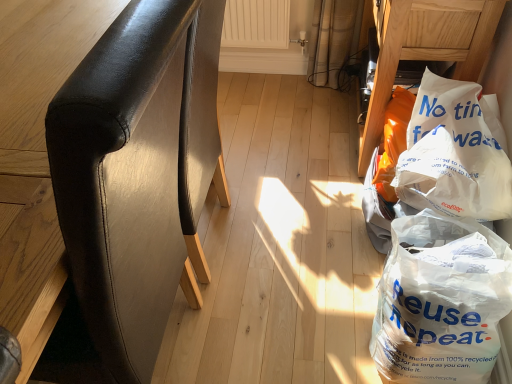
Locate an element on the screen. The height and width of the screenshot is (384, 512). white plastic bag at lower right, which is the second plastic bag from top to bottom is located at coordinates (441, 301).

Image resolution: width=512 pixels, height=384 pixels. What do you see at coordinates (455, 152) in the screenshot? I see `white paper bag at lower right, the second plastic bag when ordered from bottom to top` at bounding box center [455, 152].

This screenshot has width=512, height=384. Describe the element at coordinates (428, 49) in the screenshot. I see `white plastic bag at lower right, the second furniture when ordered from left to right` at that location.

You are a GUI agent. You are given a task and a screenshot of the screen. Output one action in this format:
    pyautogui.click(x=<x>, y=<y>)
    Task: Click on the white plastic bag at lower right, which is the second plastic bag from top to bottom
    This screenshot has width=512, height=384.
    Given the screenshot: What is the action you would take?
    pyautogui.click(x=441, y=301)

How different are the orientations of white paper bag at lower right, which is the 1th plastic bag in top-to-bottom order, and white plastic bag at lower right, which is the 1th furniture in right-to-left order, in degrees?

white paper bag at lower right, which is the 1th plastic bag in top-to-bottom order, and white plastic bag at lower right, which is the 1th furniture in right-to-left order, are facing 0.155 degrees away from each other.

The height and width of the screenshot is (384, 512). I want to click on furniture above the white paper bag at lower right, the second plastic bag when ordered from bottom to top (from the image's perspective), so click(x=428, y=49).

Does white paper bag at lower right, which is the 1th plastic bag in top-to-bottom order, appear on the left side of white plastic bag at lower right, which is the 1th furniture in right-to-left order?

Indeed, white paper bag at lower right, which is the 1th plastic bag in top-to-bottom order, is positioned on the left side of white plastic bag at lower right, which is the 1th furniture in right-to-left order.

Is white plastic bag at lower right, the second furniture when ordered from left to right, completely or partially inside white paper bag at lower right, the second plastic bag when ordered from bottom to top?

Definitely not — white plastic bag at lower right, the second furniture when ordered from left to right, is not inside white paper bag at lower right, the second plastic bag when ordered from bottom to top.

Between white paper bag at lower right, the second plastic bag when ordered from bottom to top, and black leather chair at left, the first furniture from the left, which one has smaller width?

Thinner between the two is white paper bag at lower right, the second plastic bag when ordered from bottom to top.

Is white paper bag at lower right, which is the 1th plastic bag in top-to-bottom order, facing towards black leather chair at left, which ranks as the second furniture in right-to-left order?

Yes, white paper bag at lower right, which is the 1th plastic bag in top-to-bottom order, faces towards black leather chair at left, which ranks as the second furniture in right-to-left order.

From the image's perspective, which one is positioned higher, white paper bag at lower right, which is the 1th plastic bag in top-to-bottom order, or black leather chair at left, the first furniture from the left?

white paper bag at lower right, which is the 1th plastic bag in top-to-bottom order, from the image's perspective.

Based on the photo, considering the positions of objects white paper bag at lower right, the second plastic bag when ordered from bottom to top, and white plastic bag at lower right, positioned as the 1th plastic bag in bottom-to-top order, in the image provided, who is more to the left, white paper bag at lower right, the second plastic bag when ordered from bottom to top, or white plastic bag at lower right, positioned as the 1th plastic bag in bottom-to-top order,?

Positioned to the left is white plastic bag at lower right, positioned as the 1th plastic bag in bottom-to-top order.

Could you tell me if white paper bag at lower right, the second plastic bag when ordered from bottom to top, is turned towards white plastic bag at lower right, positioned as the 1th plastic bag in bottom-to-top order?

No, white paper bag at lower right, the second plastic bag when ordered from bottom to top, is not turned towards white plastic bag at lower right, positioned as the 1th plastic bag in bottom-to-top order.

Is white paper bag at lower right, which is the 1th plastic bag in top-to-bottom order, far from white plastic bag at lower right, which is the second plastic bag from top to bottom?

No, there isn't a large distance between white paper bag at lower right, which is the 1th plastic bag in top-to-bottom order, and white plastic bag at lower right, which is the second plastic bag from top to bottom.

Which object is positioned more to the right, white plastic bag at lower right, the second furniture when ordered from left to right, or white plastic bag at lower right, positioned as the 1th plastic bag in bottom-to-top order?

white plastic bag at lower right, the second furniture when ordered from left to right.

At what (x,y) coordinates should I click in order to perform the action: click on plastic bag that is the 2nd object to the left of the white plastic bag at lower right, which is the 1th furniture in right-to-left order, starting at the anchor. Please return your answer as a coordinate pair (x, y). This screenshot has height=384, width=512. Looking at the image, I should click on (441, 301).

How different are the orientations of white plastic bag at lower right, the second furniture when ordered from left to right, and white plastic bag at lower right, positioned as the 1th plastic bag in bottom-to-top order, in degrees?

There is a 0.155-degree angle between the facing directions of white plastic bag at lower right, the second furniture when ordered from left to right, and white plastic bag at lower right, positioned as the 1th plastic bag in bottom-to-top order.

Is white plastic bag at lower right, the second furniture when ordered from left to right, shorter than white plastic bag at lower right, positioned as the 1th plastic bag in bottom-to-top order?

In fact, white plastic bag at lower right, the second furniture when ordered from left to right, may be taller than white plastic bag at lower right, positioned as the 1th plastic bag in bottom-to-top order.

How far apart are black leather chair at left, the first furniture from the left, and white plastic bag at lower right, positioned as the 1th plastic bag in bottom-to-top order?

black leather chair at left, the first furniture from the left, and white plastic bag at lower right, positioned as the 1th plastic bag in bottom-to-top order, are 27.25 inches apart.

Image resolution: width=512 pixels, height=384 pixels. I want to click on plastic bag below the black leather chair at left, the first furniture from the left (from the image's perspective), so click(441, 301).

Is black leather chair at left, which ranks as the second furniture in right-to-left order, smaller than white plastic bag at lower right, which is the second plastic bag from top to bottom?

Incorrect, black leather chair at left, which ranks as the second furniture in right-to-left order, is not smaller in size than white plastic bag at lower right, which is the second plastic bag from top to bottom.

Is black leather chair at left, which ranks as the second furniture in right-to-left order, far away from white plastic bag at lower right, which is the second plastic bag from top to bottom?

black leather chair at left, which ranks as the second furniture in right-to-left order, is actually quite close to white plastic bag at lower right, which is the second plastic bag from top to bottom.

From the picture: Considering the relative positions of white plastic bag at lower right, the second furniture when ordered from left to right, and black leather chair at left, the first furniture from the left, in the image provided, is white plastic bag at lower right, the second furniture when ordered from left to right, to the left of black leather chair at left, the first furniture from the left, from the viewer's perspective?

Incorrect, white plastic bag at lower right, the second furniture when ordered from left to right, is not on the left side of black leather chair at left, the first furniture from the left.

Who is smaller, white plastic bag at lower right, which is the 1th furniture in right-to-left order, or black leather chair at left, the first furniture from the left?

Smaller between the two is white plastic bag at lower right, which is the 1th furniture in right-to-left order.

Is white plastic bag at lower right, the second furniture when ordered from left to right, oriented towards black leather chair at left, which ranks as the second furniture in right-to-left order?

No, white plastic bag at lower right, the second furniture when ordered from left to right, is not facing towards black leather chair at left, which ranks as the second furniture in right-to-left order.

Between white plastic bag at lower right, which is the second plastic bag from top to bottom, and black leather chair at left, the first furniture from the left, which one appears on the left side from the viewer's perspective?

black leather chair at left, the first furniture from the left, is more to the left.

Are white plastic bag at lower right, positioned as the 1th plastic bag in bottom-to-top order, and black leather chair at left, which ranks as the second furniture in right-to-left order, making contact?

white plastic bag at lower right, positioned as the 1th plastic bag in bottom-to-top order, and black leather chair at left, which ranks as the second furniture in right-to-left order, are not in contact.

Consider the image. Who is taller, white plastic bag at lower right, positioned as the 1th plastic bag in bottom-to-top order, or black leather chair at left, the first furniture from the left?

Standing taller between the two is black leather chair at left, the first furniture from the left.

Based on the photo, how distant is white plastic bag at lower right, positioned as the 1th plastic bag in bottom-to-top order, from black leather chair at left, the first furniture from the left?

The distance of white plastic bag at lower right, positioned as the 1th plastic bag in bottom-to-top order, from black leather chair at left, the first furniture from the left, is 27.25 inches.

From the image's perspective, count 1st plastic bags downward from the white plastic bag at lower right, which is the 1th furniture in right-to-left order, and point to it. Please provide its 2D coordinates.

[(455, 152)]

From a real-world perspective, which furniture is the 1st one underneath the white paper bag at lower right, the second plastic bag when ordered from bottom to top? Please provide its 2D coordinates.

[(120, 185)]

Looking at the image, which one is located closer to black leather chair at left, the first furniture from the left, white paper bag at lower right, which is the 1th plastic bag in top-to-bottom order, or white plastic bag at lower right, the second furniture when ordered from left to right?

white paper bag at lower right, which is the 1th plastic bag in top-to-bottom order, lies closer to black leather chair at left, the first furniture from the left, than the other object.

When comparing their distances from white plastic bag at lower right, which is the 1th furniture in right-to-left order, does black leather chair at left, which ranks as the second furniture in right-to-left order, or white plastic bag at lower right, positioned as the 1th plastic bag in bottom-to-top order, seem further?

Based on the image, black leather chair at left, which ranks as the second furniture in right-to-left order, appears to be further to white plastic bag at lower right, which is the 1th furniture in right-to-left order.

From the image, which object appears to be nearer to white paper bag at lower right, the second plastic bag when ordered from bottom to top, white plastic bag at lower right, the second furniture when ordered from left to right, or black leather chair at left, the first furniture from the left?

white plastic bag at lower right, the second furniture when ordered from left to right, is closer to white paper bag at lower right, the second plastic bag when ordered from bottom to top.

Considering their positions, is white plastic bag at lower right, the second furniture when ordered from left to right, positioned closer to white plastic bag at lower right, which is the second plastic bag from top to bottom, than black leather chair at left, the first furniture from the left?

Based on the image, white plastic bag at lower right, the second furniture when ordered from left to right, appears to be nearer to white plastic bag at lower right, which is the second plastic bag from top to bottom.

When comparing their distances from black leather chair at left, which ranks as the second furniture in right-to-left order, does white plastic bag at lower right, the second furniture when ordered from left to right, or white plastic bag at lower right, positioned as the 1th plastic bag in bottom-to-top order, seem closer?

white plastic bag at lower right, positioned as the 1th plastic bag in bottom-to-top order, lies closer to black leather chair at left, which ranks as the second furniture in right-to-left order, than the other object.

Considering their positions, is black leather chair at left, the first furniture from the left, positioned further to white paper bag at lower right, which is the 1th plastic bag in top-to-bottom order, than white plastic bag at lower right, which is the 1th furniture in right-to-left order?

black leather chair at left, the first furniture from the left, is further to white paper bag at lower right, which is the 1th plastic bag in top-to-bottom order.

Looking at this image, estimate the real-world distances between objects in this image. Which object is closer to white plastic bag at lower right, positioned as the 1th plastic bag in bottom-to-top order, white paper bag at lower right, the second plastic bag when ordered from bottom to top, or black leather chair at left, which ranks as the second furniture in right-to-left order?

white paper bag at lower right, the second plastic bag when ordered from bottom to top.

When comparing their distances from white plastic bag at lower right, which is the 1th furniture in right-to-left order, does white plastic bag at lower right, positioned as the 1th plastic bag in bottom-to-top order, or black leather chair at left, the first furniture from the left, seem closer?

Based on the image, white plastic bag at lower right, positioned as the 1th plastic bag in bottom-to-top order, appears to be nearer to white plastic bag at lower right, which is the 1th furniture in right-to-left order.

Image resolution: width=512 pixels, height=384 pixels. I want to click on plastic bag located between black leather chair at left, the first furniture from the left, and white paper bag at lower right, which is the 1th plastic bag in top-to-bottom order, in the left-right direction, so click(441, 301).

Where is `plastic bag between white plastic bag at lower right, the second furniture when ordered from left to right, and white plastic bag at lower right, which is the second plastic bag from top to bottom, in the vertical direction`? plastic bag between white plastic bag at lower right, the second furniture when ordered from left to right, and white plastic bag at lower right, which is the second plastic bag from top to bottom, in the vertical direction is located at coordinates (455, 152).